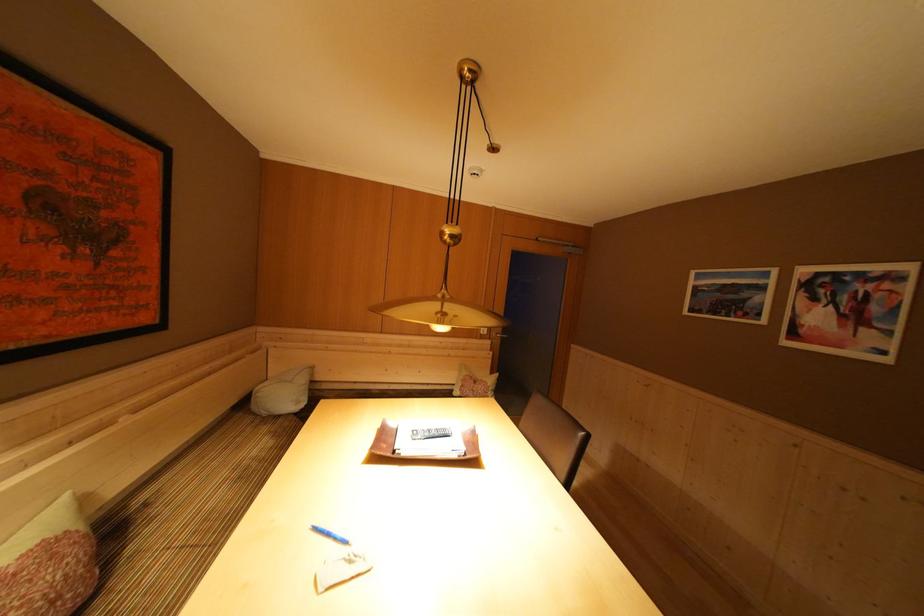
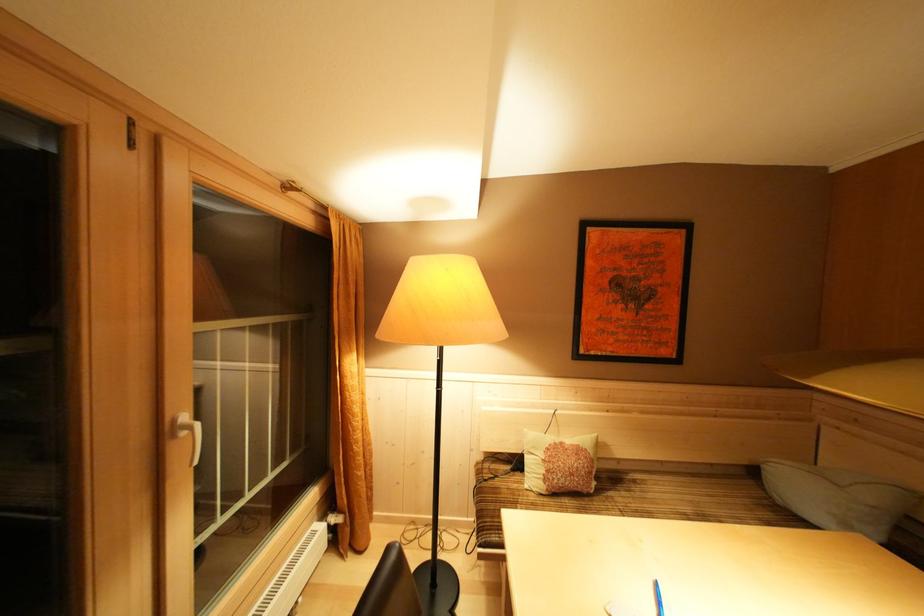
Question: The camera is either moving clockwise (left) or counter-clockwise (right) around the object. The first image is from the beginning of the video and the second image is from the end. Is the camera moving left or right when shooting the video?

Choices:
 (A) Left
 (B) Right

Answer: (B)